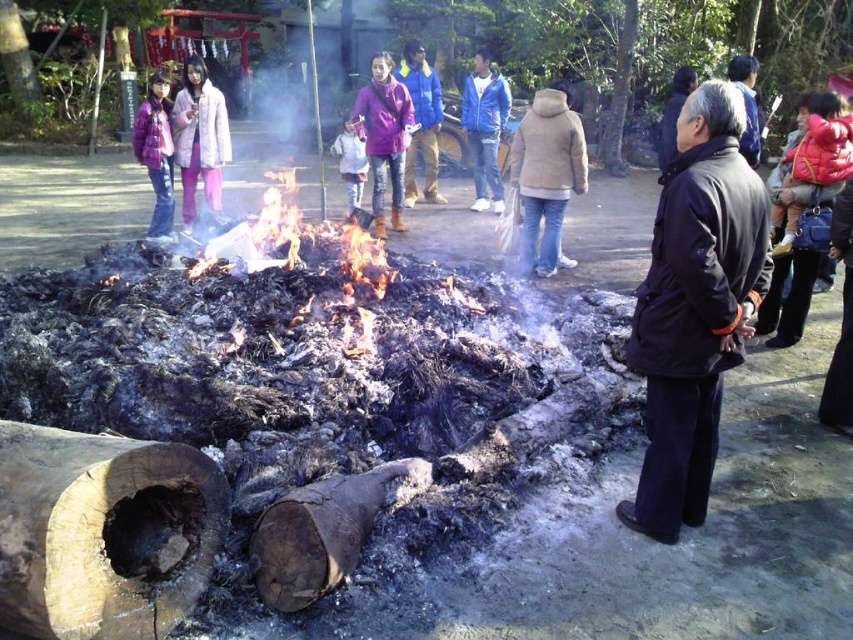
Question: Considering the real-world distances, which object is farthest from the purple matte jacket at center?

Choices:
 (A) light brown jacket at center
 (B) dark woolen coat at right
 (C) blue down jacket at center
 (D) gray woolen sweater at upper center

Answer: (B)

Question: Can you confirm if purple matte jacket at center is bigger than black wool coat at right?

Choices:
 (A) no
 (B) yes

Answer: (A)

Question: Which point is farther from the camera taking this photo?

Choices:
 (A) (553, 163)
 (B) (413, 90)
 (C) (9, 467)
 (D) (792, 264)

Answer: (B)

Question: Which object appears farthest from the camera in this image?

Choices:
 (A) red puffer jacket at lower right
 (B) blue down jacket at center
 (C) charred wood log at lower left
 (D) purple fleece jacket at upper left

Answer: (B)

Question: Does blue down jacket at center appear under light purple fleece jacket at center?

Choices:
 (A) no
 (B) yes

Answer: (A)

Question: Can you confirm if purple matte jacket at center is thinner than blue jacket at center?

Choices:
 (A) no
 (B) yes

Answer: (A)